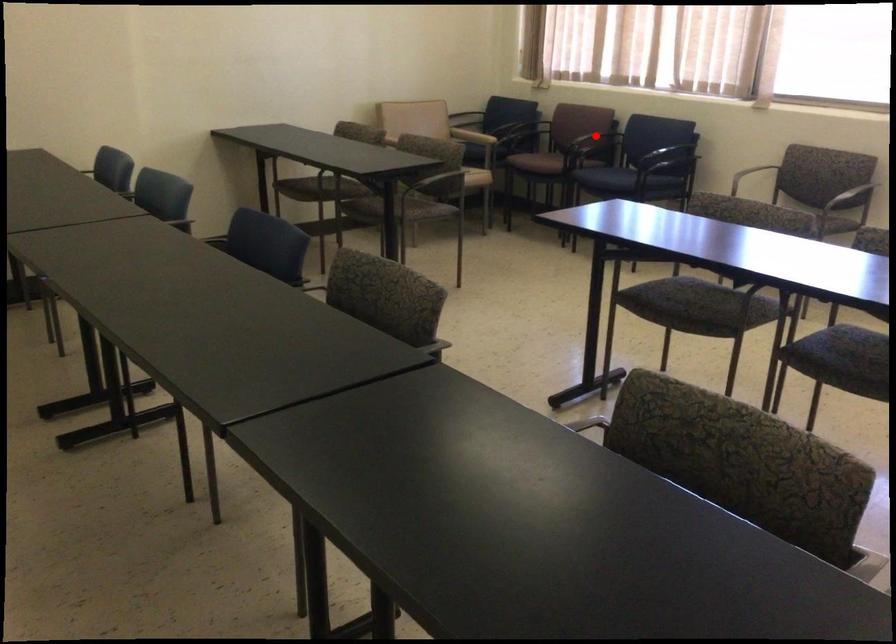
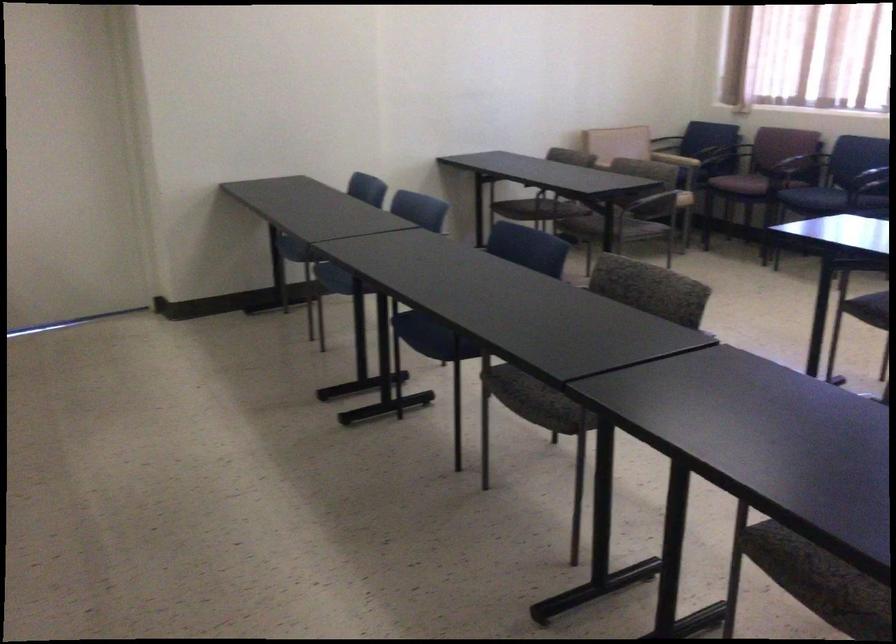
The point at the highlighted location is marked in the first image. Where is the corresponding point in the second image?

(800, 160)